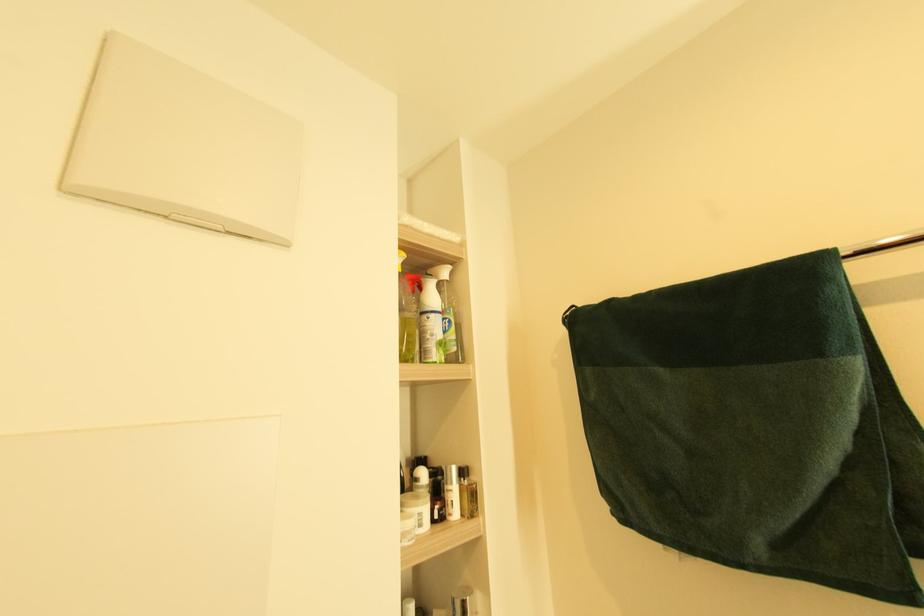
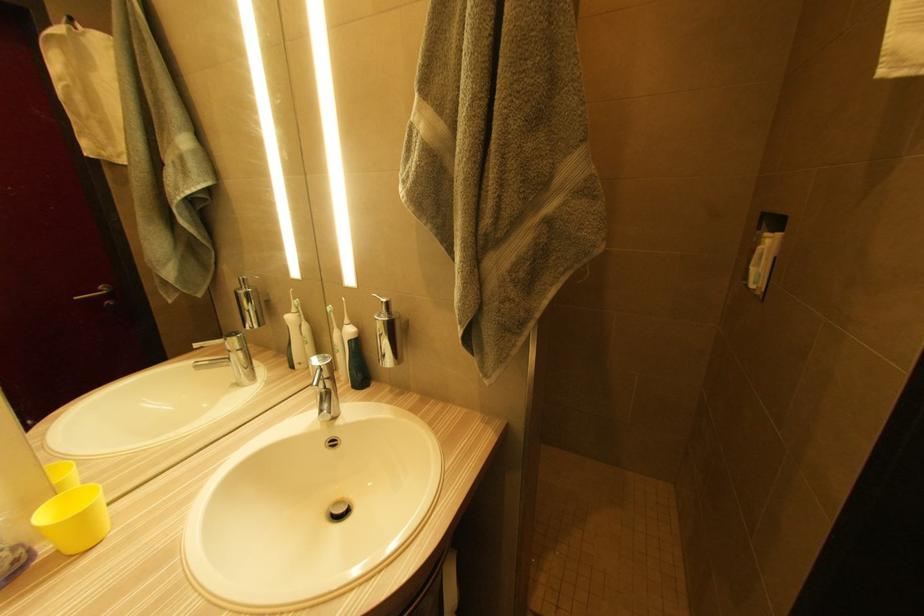
Question: The camera is either moving clockwise (left) or counter-clockwise (right) around the object. The first image is from the beginning of the video and the second image is from the end. Is the camera moving left or right when shooting the video?

Choices:
 (A) Left
 (B) Right

Answer: (A)